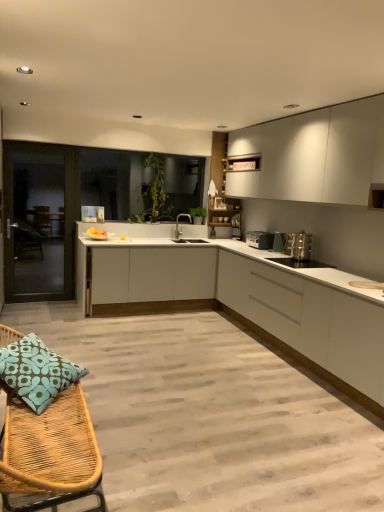
Question: Can you confirm if satin nickel faucet at center is positioned to the left of white matte cabinet at right, which ranks as the third cabinetry in top-to-bottom order?

Choices:
 (A) yes
 (B) no

Answer: (A)

Question: Considering the relative sizes of satin nickel faucet at center and white matte cabinet at right, which ranks as the third cabinetry in top-to-bottom order, in the image provided, is satin nickel faucet at center smaller than white matte cabinet at right, which ranks as the third cabinetry in top-to-bottom order,?

Choices:
 (A) yes
 (B) no

Answer: (A)

Question: Is satin nickel faucet at center far away from white matte cabinet at right, arranged as the 1th cabinetry when ordered from the bottom?

Choices:
 (A) yes
 (B) no

Answer: (A)

Question: From a real-world perspective, is satin nickel faucet at center under white matte cabinet at right, which ranks as the third cabinetry in top-to-bottom order?

Choices:
 (A) yes
 (B) no

Answer: (B)

Question: From the image's perspective, is satin nickel faucet at center located beneath white matte cabinet at right, arranged as the 1th cabinetry when ordered from the bottom?

Choices:
 (A) yes
 (B) no

Answer: (B)

Question: Looking at their shapes, would you say white matte cabinet at right, arranged as the 1th cabinetry when ordered from the bottom, is wider or thinner than silver metallic toaster at center, which appears as the 1th appliance when viewed from the back?

Choices:
 (A) thin
 (B) wide

Answer: (B)

Question: Is white matte cabinet at right, arranged as the 1th cabinetry when ordered from the bottom, bigger or smaller than silver metallic toaster at center, which is the third appliance in front-to-back order?

Choices:
 (A) big
 (B) small

Answer: (A)

Question: From a real-world perspective, is white matte cabinet at right, arranged as the 1th cabinetry when ordered from the bottom, positioned above or below silver metallic toaster at center, which is the third appliance in front-to-back order?

Choices:
 (A) below
 (B) above

Answer: (A)

Question: Would you say white matte cabinet at right, arranged as the 1th cabinetry when ordered from the bottom, is to the left or to the right of silver metallic toaster at center, which is the third appliance in front-to-back order, in the picture?

Choices:
 (A) left
 (B) right

Answer: (B)

Question: From a real-world perspective, is satin silver toaster at right, which appears as the 2th appliance when viewed from the back, physically located above or below woven wood bench at lower left?

Choices:
 (A) above
 (B) below

Answer: (A)

Question: Visually, is satin silver toaster at right, which ranks as the second appliance in front-to-back order, positioned to the left or to the right of woven wood bench at lower left?

Choices:
 (A) left
 (B) right

Answer: (B)

Question: Is point (273, 243) positioned closer to the camera than point (52, 496)?

Choices:
 (A) closer
 (B) farther

Answer: (B)

Question: In terms of height, does satin silver toaster at right, which appears as the 2th appliance when viewed from the back, look taller or shorter compared to woven wood bench at lower left?

Choices:
 (A) short
 (B) tall

Answer: (A)

Question: Do you think satin nickel faucet at center is within transparent glass door at left, or outside of it?

Choices:
 (A) inside
 (B) outside

Answer: (B)

Question: Would you say satin nickel faucet at center is to the left or to the right of transparent glass door at left in the picture?

Choices:
 (A) right
 (B) left

Answer: (A)